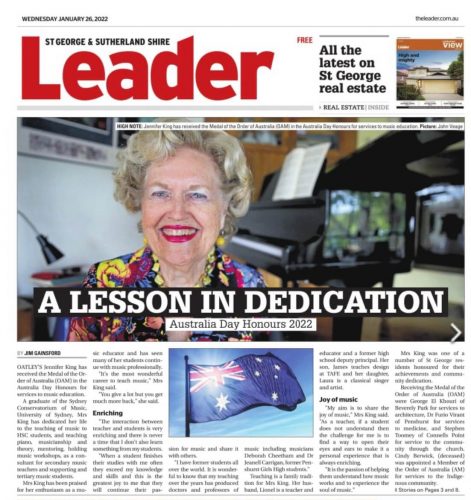
This screenshot has height=500, width=471. Find the location of `newspaper`. newspaper is located at coordinates (254, 37).